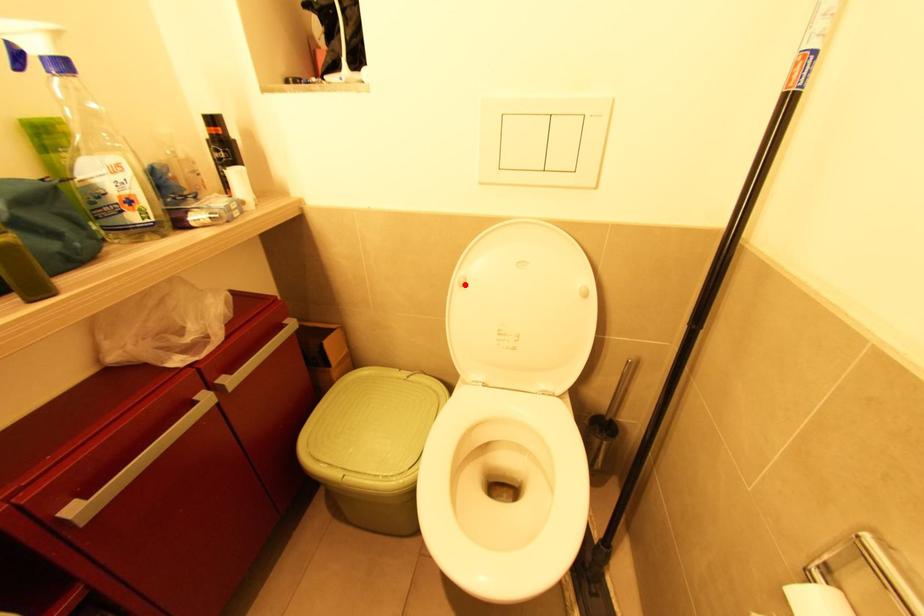
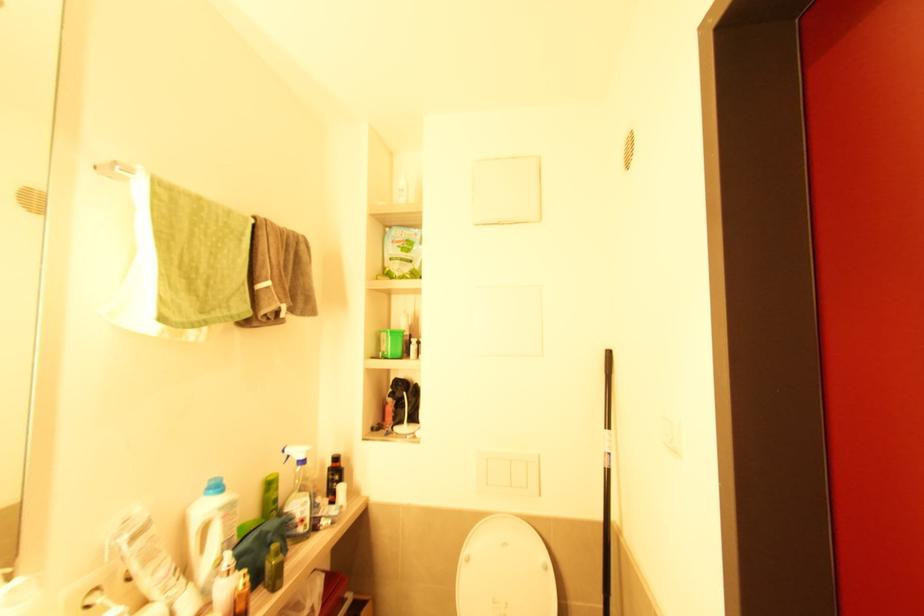
Locate, in the second image, the point that corresponds to the highlighted location in the first image.

(469, 561)